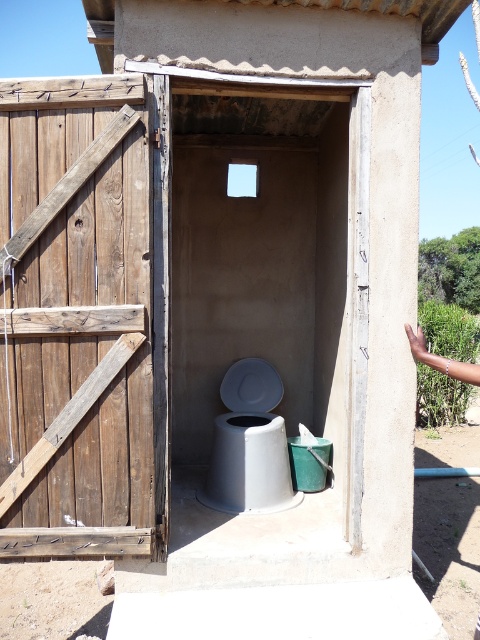
You are standing outside the outdoor toilet structure and want to enter. Which object, the weathered wood door at left or the white plastic toilet at center, should you approach to enter the structure?

You should approach the weathered wood door at left to enter the structure because doors are typically used for entry and exit, while the white plastic toilet at center is a fixture inside the toilet area.

You are standing inside the outdoor toilet structure and notice two points marked on the wall. The first point is at coordinate point[212,365] and the second is at point[253,492]. Which point is closer to you?

Point[212,365] is closer to you because it is further to the viewer than point[253,492].

You are a painter who needs to know the height of the weathered wood door at left and the white plastic toilet at center to decide which one requires more paint. Based on the scene, which object is taller?

The weathered wood door at left is much taller than the white plastic toilet at center, so it requires more paint.